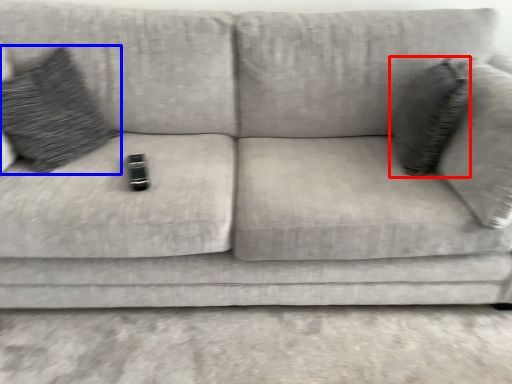
Question: Which object appears farthest to the camera in this image, throw pillow (highlighted by a red box) or throw pillow (highlighted by a blue box)?

Choices:
 (A) throw pillow
 (B) throw pillow

Answer: (A)